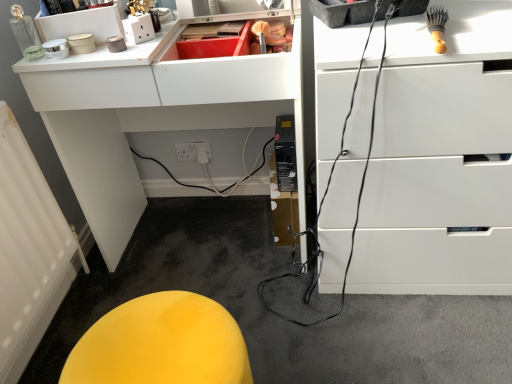
You are a GUI agent. You are given a task and a screenshot of the screen. Output one action in this format:
    pyautogui.click(x=<x>, y=<y>)
    Task: Click on the free location to the right of wooden-handled brush at upper right
    
    Given the screenshot: What is the action you would take?
    pyautogui.click(x=477, y=30)